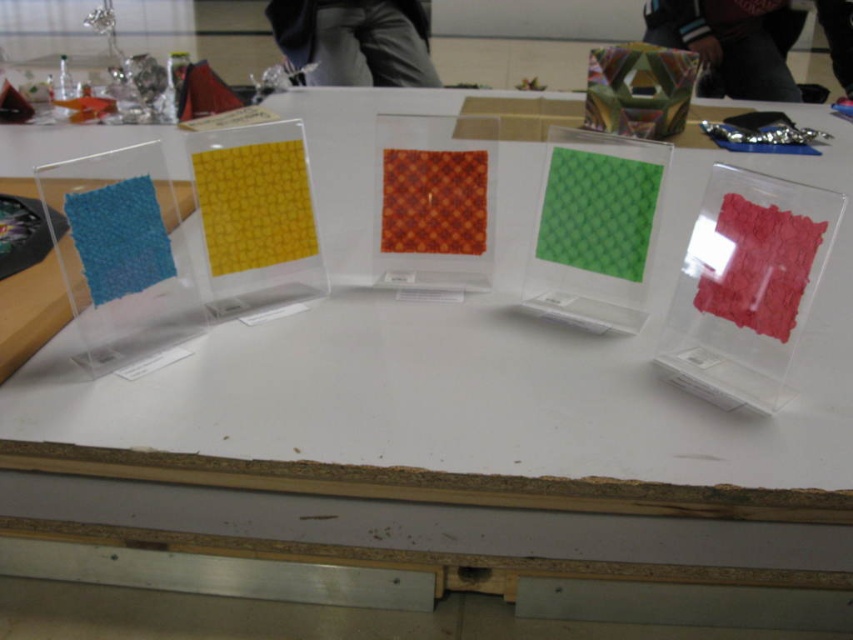
Which is below, orange woven fabric at center or matte red fabric at center?

matte red fabric at center

Consider the image. Is orange woven fabric at center above matte red fabric at center?

Yes.

Does point (415, 198) lie behind point (793, 316)?

Yes, it is behind point (793, 316).

I want to click on orange woven fabric at center, so click(432, 204).

Describe the element at coordinates (256, 211) in the screenshot. I see `yellow textured paper at center` at that location.

Which is more to the left, yellow textured paper at center or matte red fabric at center?

From the viewer's perspective, yellow textured paper at center appears more on the left side.

Describe the element at coordinates (256, 211) in the screenshot. I see `yellow textured paper at center` at that location.

This screenshot has width=853, height=640. Find the location of `yellow textured paper at center`. yellow textured paper at center is located at coordinates (256, 211).

Is yellow textured paper at center to the left of metallic hexagonal prism at upper center from the viewer's perspective?

Yes, yellow textured paper at center is to the left of metallic hexagonal prism at upper center.

The height and width of the screenshot is (640, 853). I want to click on yellow textured paper at center, so click(x=256, y=211).